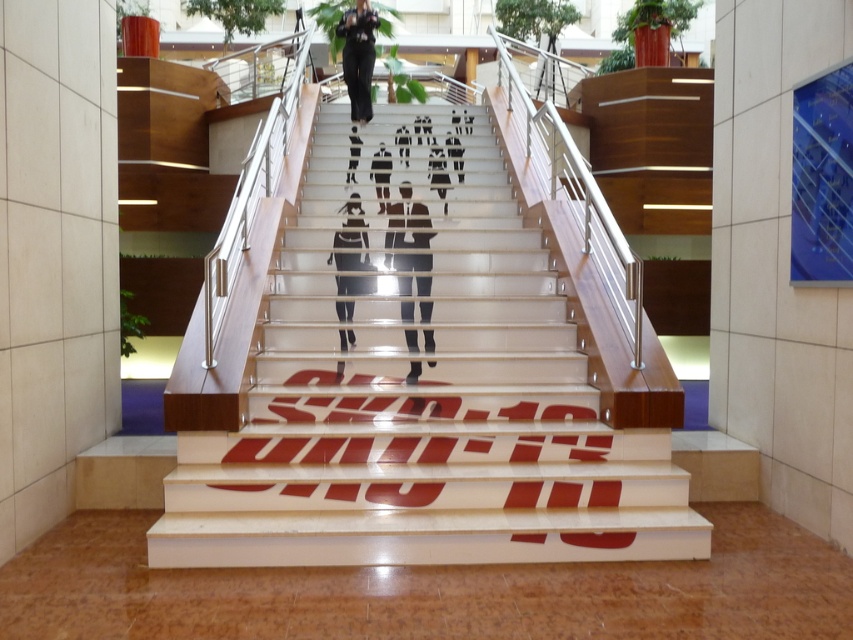
Which is above, matte black figure at center or black fabric pants at center?

Positioned higher is black fabric pants at center.

Which is in front, point (404, 282) or point (366, 122)?

Point (404, 282)

Identify the location of matte black figure at center. The height and width of the screenshot is (640, 853). (407, 234).

Does point (489, 216) lie behind point (357, 221)?

Yes.

In the scene shown: Between white glossy stairs at center and black glossy pants at center, which one is positioned higher?

black glossy pants at center

Is point (479, 282) less distant than point (337, 259)?

Yes, point (479, 282) is in front of point (337, 259).

I want to click on white glossy stairs at center, so click(x=421, y=392).

From the picture: Is matte black figure at center wider than black glossy pants at center?

Yes.

Who is lower down, matte black figure at center or black glossy pants at center?

matte black figure at center is below.

You are a GUI agent. You are given a task and a screenshot of the screen. Output one action in this format:
    pyautogui.click(x=<x>, y=<y>)
    Task: Click on the matte black figure at center
    
    Given the screenshot: What is the action you would take?
    pyautogui.click(x=407, y=234)